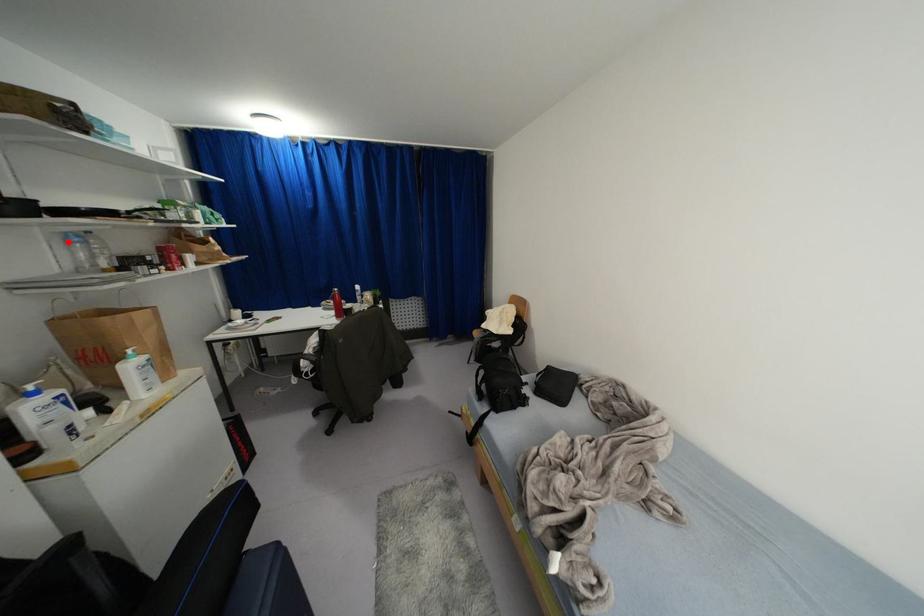
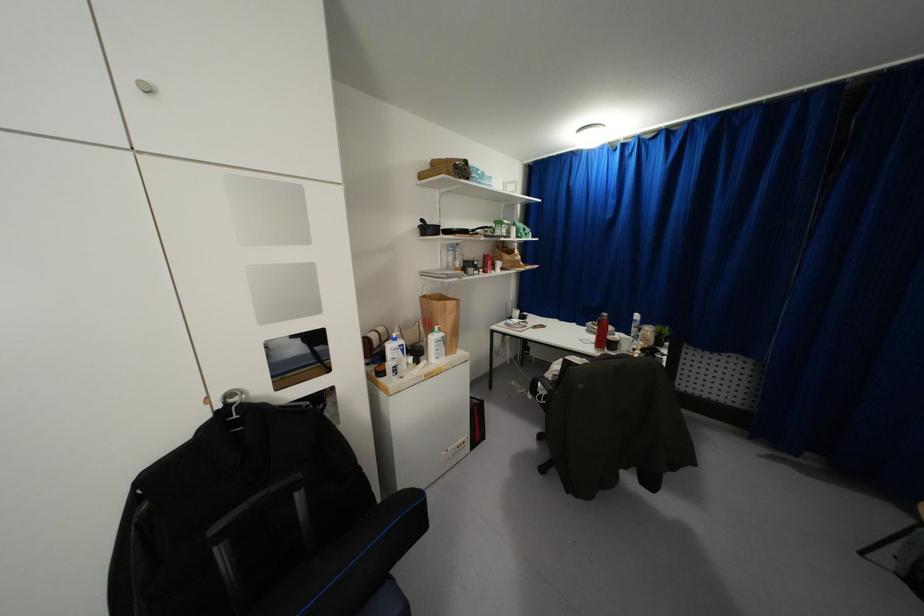
Find the pixel in the second image that matches the highlighted location in the first image.

(446, 249)